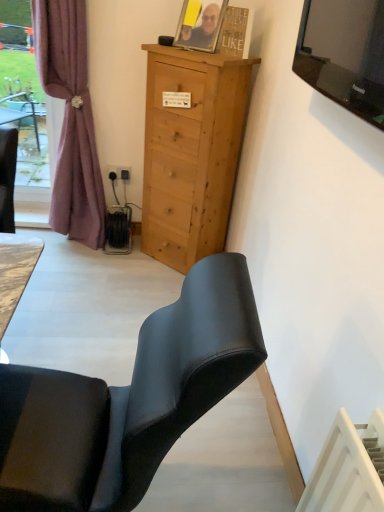
Question: From the image's perspective, is light brown wood cabinet at center located beneath black plastic power outlet at lower left?

Choices:
 (A) no
 (B) yes

Answer: (B)

Question: Is light brown wood cabinet at center positioned before black plastic power outlet at lower left?

Choices:
 (A) yes
 (B) no

Answer: (A)

Question: From a real-world perspective, is light brown wood cabinet at center located higher than black plastic power outlet at lower left?

Choices:
 (A) yes
 (B) no

Answer: (A)

Question: Is light brown wood cabinet at center looking in the opposite direction of black plastic power outlet at lower left?

Choices:
 (A) no
 (B) yes

Answer: (A)

Question: From the image's perspective, is light brown wood cabinet at center on black plastic power outlet at lower left?

Choices:
 (A) no
 (B) yes

Answer: (A)

Question: Is matte black chair at lower left wider or thinner than mauve fabric curtain at left?

Choices:
 (A) thin
 (B) wide

Answer: (B)

Question: From the image's perspective, is matte black chair at lower left above or below mauve fabric curtain at left?

Choices:
 (A) above
 (B) below

Answer: (B)

Question: Do you think matte black chair at lower left is within mauve fabric curtain at left, or outside of it?

Choices:
 (A) inside
 (B) outside

Answer: (B)

Question: From a real-world perspective, is matte black chair at lower left physically located above or below mauve fabric curtain at left?

Choices:
 (A) above
 (B) below

Answer: (B)

Question: Considering the positions of point (96, 501) and point (115, 174), is point (96, 501) closer or farther from the camera than point (115, 174)?

Choices:
 (A) closer
 (B) farther

Answer: (A)

Question: In terms of width, does matte black chair at lower left look wider or thinner when compared to black plastic power outlet at lower left?

Choices:
 (A) thin
 (B) wide

Answer: (B)

Question: From a real-world perspective, is matte black chair at lower left positioned above or below black plastic power outlet at lower left?

Choices:
 (A) below
 (B) above

Answer: (B)

Question: Relative to black plastic power outlet at lower left, is matte black chair at lower left in front or behind?

Choices:
 (A) behind
 (B) front

Answer: (B)

Question: Looking at their shapes, would you say light brown wood cabinet at center is wider or thinner than black plastic power outlet at lower left?

Choices:
 (A) wide
 (B) thin

Answer: (A)

Question: Considering the positions of light brown wood cabinet at center and black plastic power outlet at lower left in the image, is light brown wood cabinet at center taller or shorter than black plastic power outlet at lower left?

Choices:
 (A) short
 (B) tall

Answer: (B)